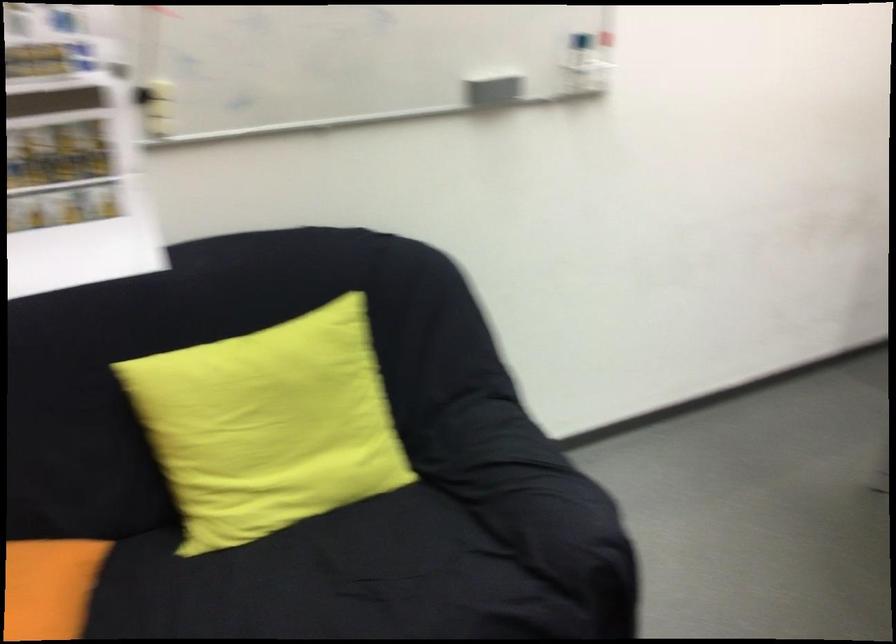
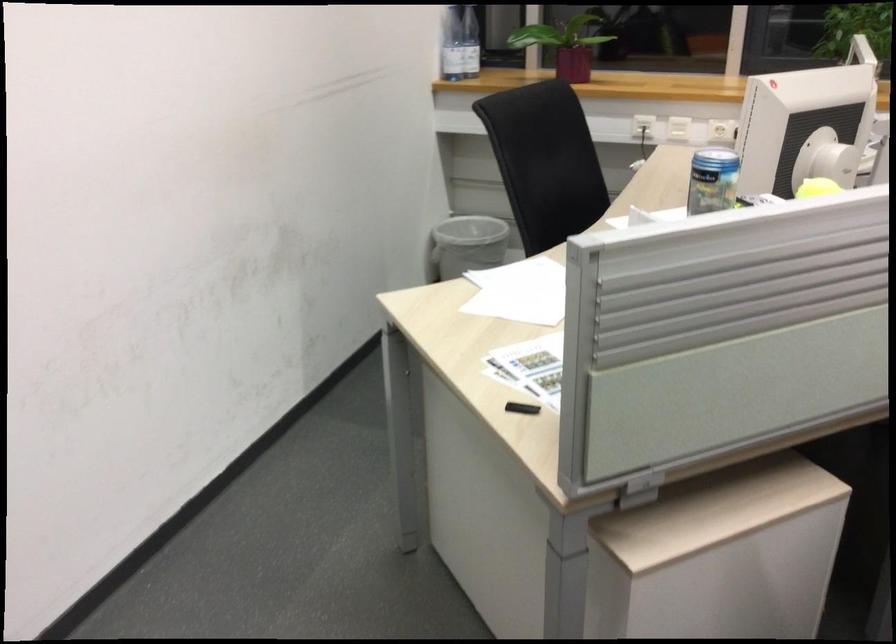
Question: The images are taken continuously from a first-person perspective. In which direction is your viewpoint rotating?

Choices:
 (A) Left
 (B) Right
 (C) Up
 (D) Down

Answer: (B)